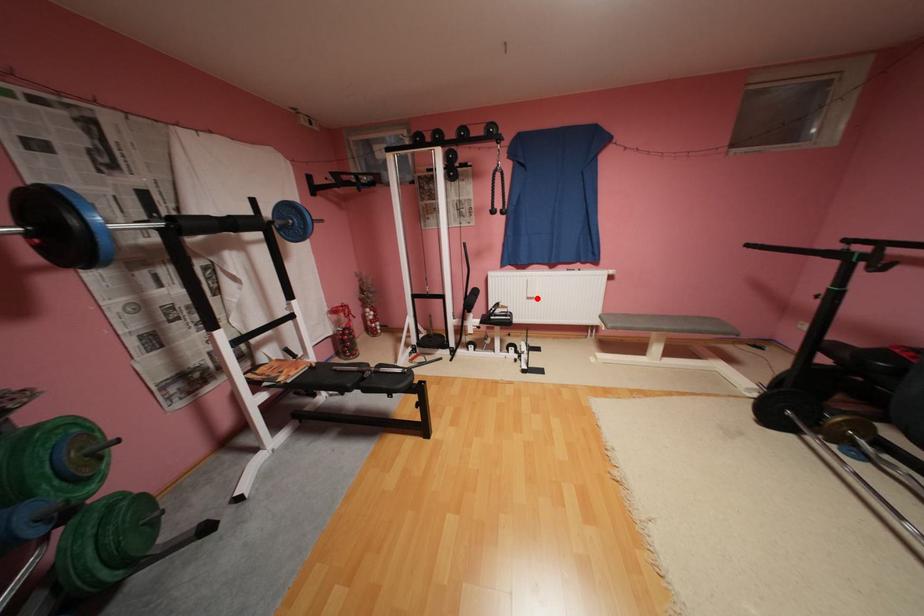
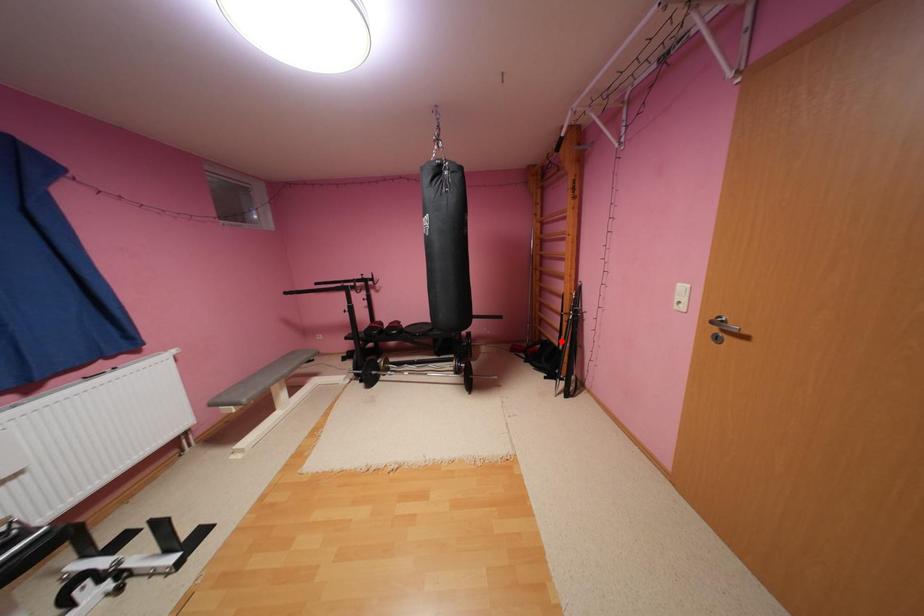
I am providing you with two images of the same scene from different viewpoints. A red point is marked on the first image and another point is marked on the second image. Is the marked point in image1 the same physical position as the marked point in image2?

No